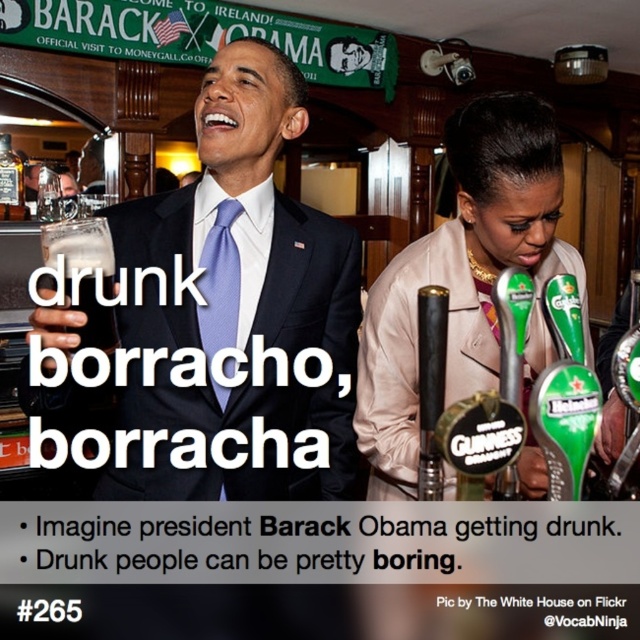
Question: Observing the image, what is the correct spatial positioning of light beige fabric jacket at center in reference to matte blue tie at center?

Choices:
 (A) below
 (B) above

Answer: (A)

Question: Which of these objects is positioned closest to the green plastic beer tap at right?

Choices:
 (A) translucent glass beer at upper left
 (B) light beige fabric jacket at center
 (C) matte blue tie at center

Answer: (B)

Question: Which point appears closest to the camera in this image?

Choices:
 (A) (54, 285)
 (B) (228, 273)
 (C) (472, 227)
 (D) (625, 458)

Answer: (A)

Question: Can you confirm if matte black suit at center is bigger than translucent glass beer at upper left?

Choices:
 (A) yes
 (B) no

Answer: (A)

Question: Is light beige fabric jacket at center smaller than matte blue tie at center?

Choices:
 (A) yes
 (B) no

Answer: (B)

Question: Which of these objects is positioned farthest from the matte blue tie at center?

Choices:
 (A) light beige fabric jacket at center
 (B) matte black suit at center
 (C) translucent glass beer at upper left

Answer: (A)